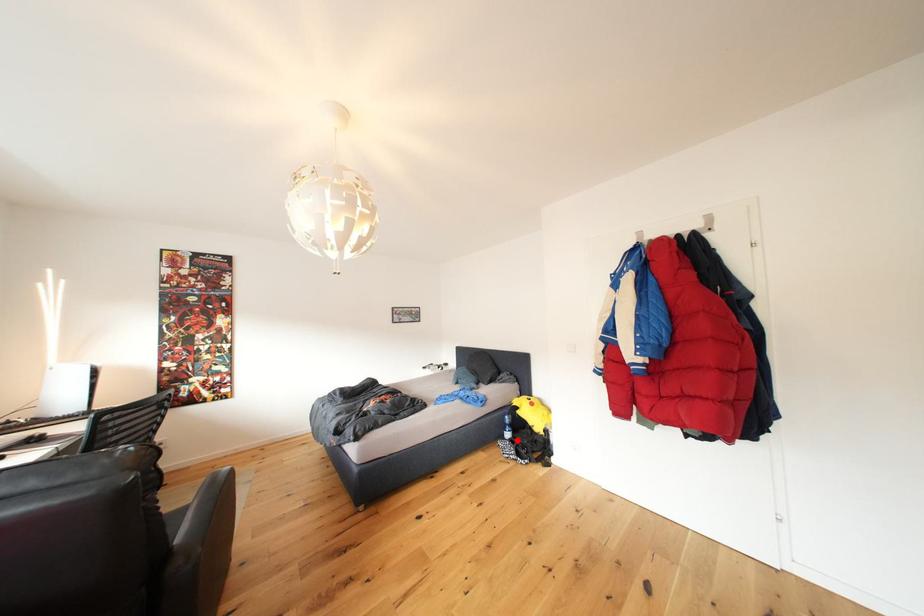
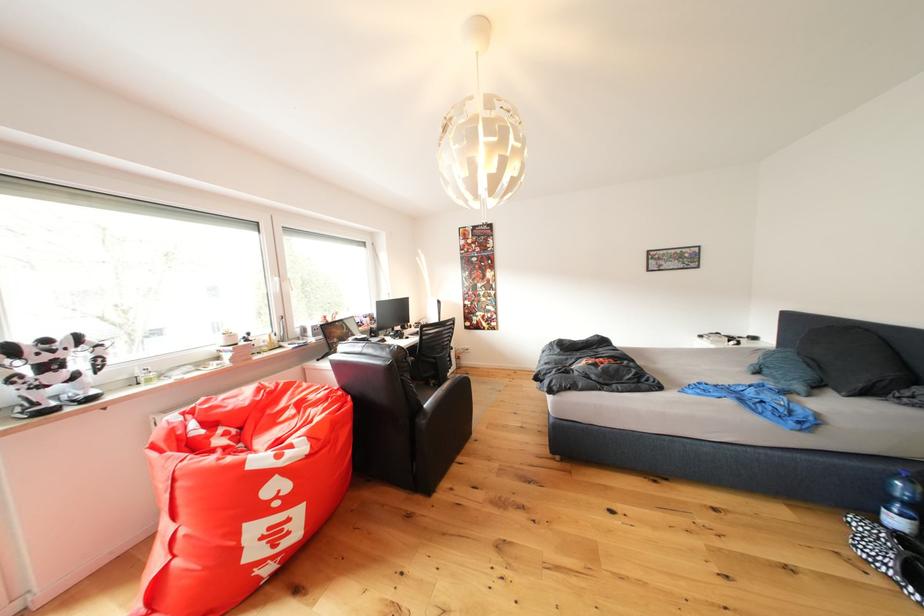
Where in the second image is the point corresponding to the highlighted location from the first image?

(906, 527)